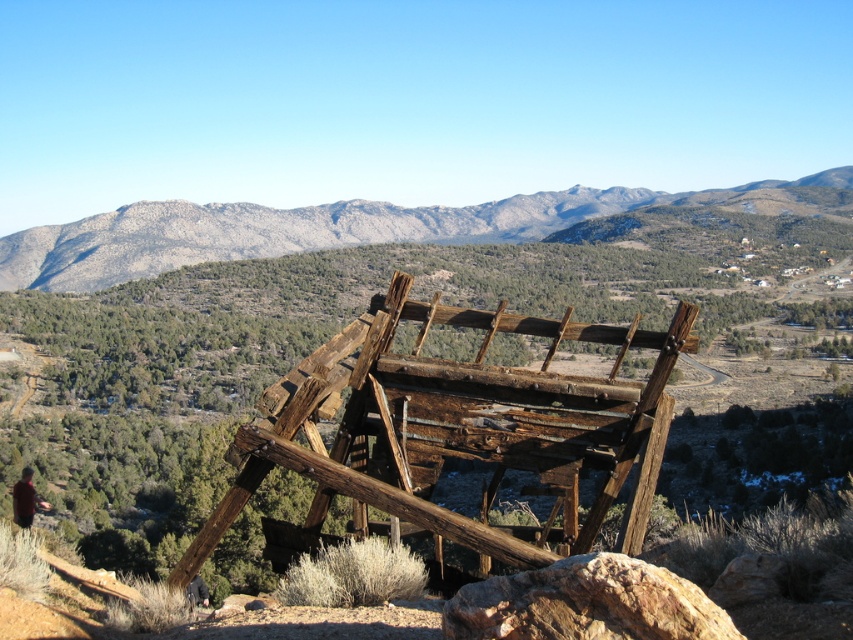
Question: Is weathered wood structure at center bigger than gray rocky mountain at center?

Choices:
 (A) yes
 (B) no

Answer: (B)

Question: Which object appears closest to the camera in this image?

Choices:
 (A) gray rocky mountain at center
 (B) rusty metal rock at lower right

Answer: (B)

Question: Based on their relative distances, which object is nearer to the gray rocky mountain at center?

Choices:
 (A) rusty metal rock at lower right
 (B) weathered wood structure at center

Answer: (A)

Question: Which of the following is the farthest from the observer?

Choices:
 (A) gray rocky mountain at center
 (B) rusty metal rock at lower right

Answer: (A)

Question: Can you confirm if gray rocky mountain at center is thinner than rusty metal rock at lower right?

Choices:
 (A) yes
 (B) no

Answer: (B)

Question: Is weathered wood structure at center thinner than gray rocky mountain at center?

Choices:
 (A) no
 (B) yes

Answer: (B)